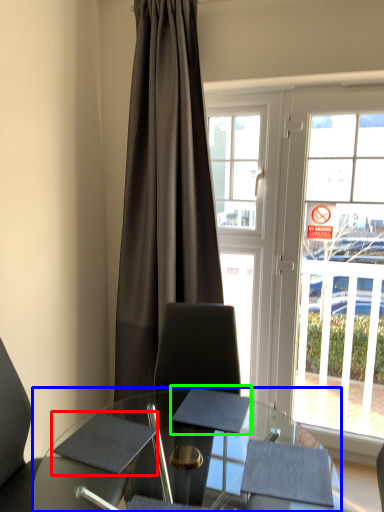
Question: Based on their relative distances, which object is nearer to notepad (highlighted by a red box)? Choose from desk (highlighted by a blue box) and notepad (highlighted by a green box).

Choices:
 (A) desk
 (B) notepad

Answer: (A)